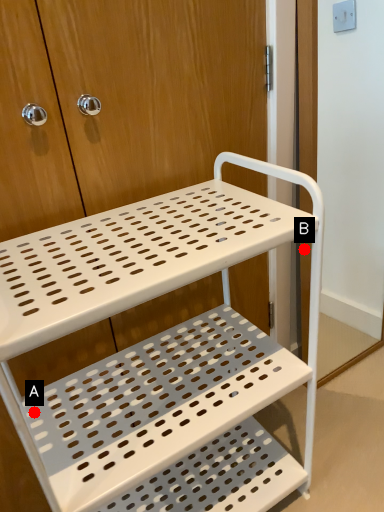
Question: Two points are circled on the image, labeled by A and B beside each circle. Which point is farther from the camera taking this photo?

Choices:
 (A) A is further
 (B) B is further

Answer: (B)